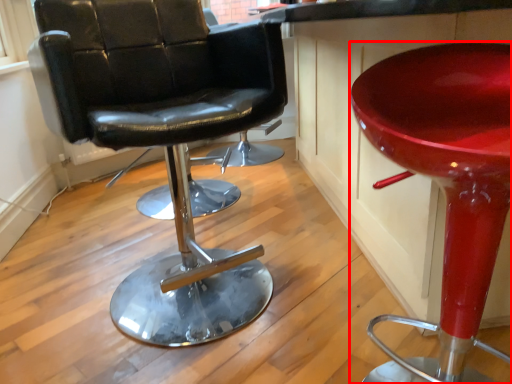
Question: Considering the relative positions of stool (annotated by the red box) and chair in the image provided, where is stool (annotated by the red box) located with respect to the staircase?

Choices:
 (A) left
 (B) right

Answer: (B)